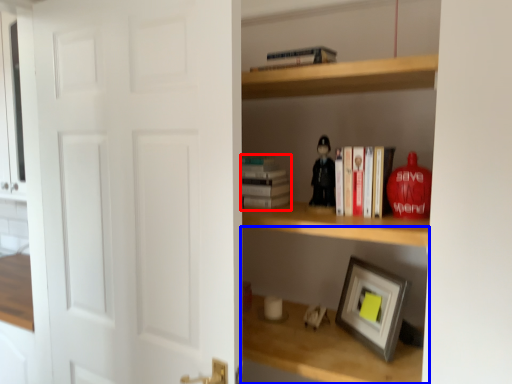
Question: Which of the following is the closest to the observer, paperback book (highlighted by a red box) or shelf (highlighted by a blue box)?

Choices:
 (A) paperback book
 (B) shelf

Answer: (B)